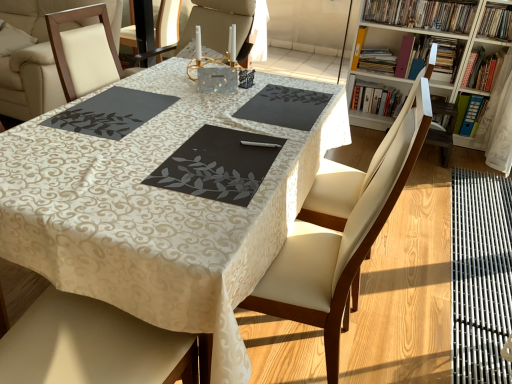
Locate an element on the screen. This screenshot has height=384, width=512. free point behind black matte place mat at center, which appears as the second place mat when viewed from the right is located at coordinates (221, 119).